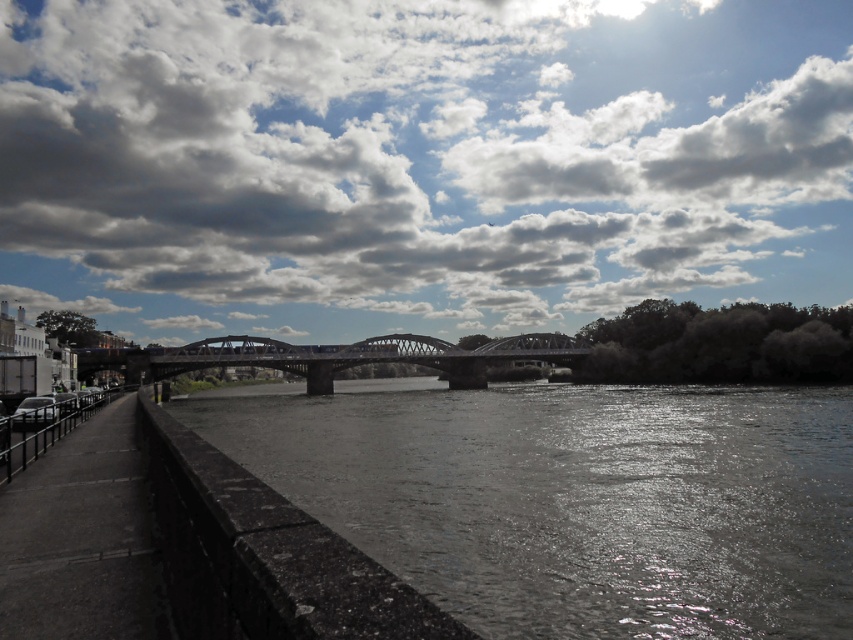
Is point (265, 250) farther from camera compared to point (851, 566)?

Yes, point (265, 250) is behind point (851, 566).

Consider the image. Is cloudy sky at upper center to the left of dark gray concrete river at center from the viewer's perspective?

In fact, cloudy sky at upper center is to the right of dark gray concrete river at center.

This screenshot has height=640, width=853. Find the location of `cloudy sky at upper center`. cloudy sky at upper center is located at coordinates (419, 161).

Can you confirm if cloudy sky at upper center is positioned to the right of metallic bridge at center?

Yes, cloudy sky at upper center is to the right of metallic bridge at center.

Which of these two, cloudy sky at upper center or metallic bridge at center, stands taller?

cloudy sky at upper center

Does point (90, 244) lie in front of point (306, 353)?

No, (90, 244) is further to viewer.

Identify the location of cloudy sky at upper center. (419, 161).

Who is more distant from viewer, (573, 426) or (149, 360)?

Point (149, 360)

Can you confirm if dark gray concrete river at center is smaller than metallic bridge at center?

Yes.

The height and width of the screenshot is (640, 853). In order to click on dark gray concrete river at center in this screenshot , I will do `click(573, 499)`.